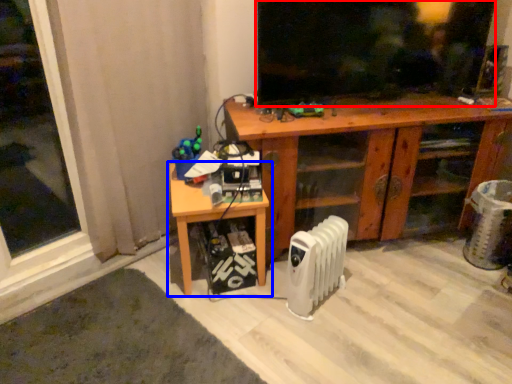
Question: Which object appears farthest to the camera in this image, window screen (highlighted by a red box) or table (highlighted by a blue box)?

Choices:
 (A) window screen
 (B) table

Answer: (A)